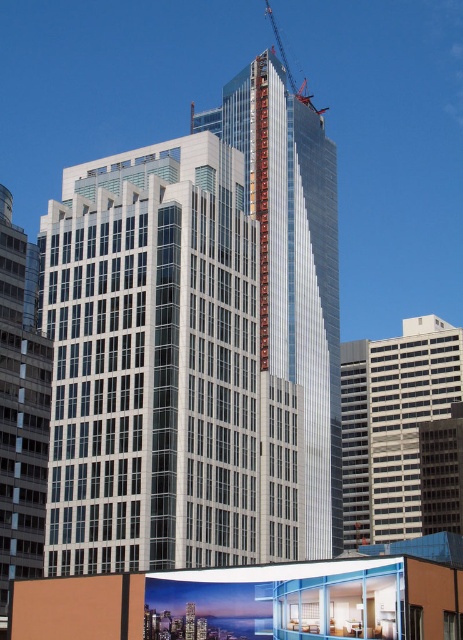
Question: Is glassy silver skyscraper at center above metallic construction crane at upper center?

Choices:
 (A) no
 (B) yes

Answer: (A)

Question: Which object is closer to the camera taking this photo?

Choices:
 (A) sleek glass tower at center
 (B) metallic construction crane at upper center
 (C) silver glass building at left

Answer: (C)

Question: Is white glass building at center positioned behind glassy silver skyscraper at center?

Choices:
 (A) yes
 (B) no

Answer: (B)

Question: Estimate the real-world distances between objects in this image. Which object is farther from the metallic construction crane at upper center?

Choices:
 (A) white glass building at center
 (B) sleek glass tower at center
 (C) glassy silver skyscraper at center
 (D) silver glass building at left

Answer: (D)

Question: Can you confirm if sleek glass tower at center is wider than glassy silver skyscraper at center?

Choices:
 (A) no
 (B) yes

Answer: (B)

Question: Which point is closer to the camera?

Choices:
 (A) (10, 468)
 (B) (394, 422)

Answer: (A)